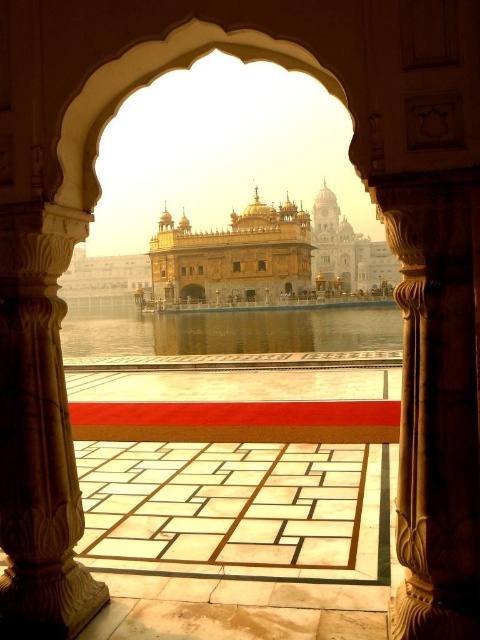
What do you see at coordinates (436, 400) in the screenshot? I see `carved stone pillar at right` at bounding box center [436, 400].

Can you confirm if carved stone pillar at right is thinner than white marble pillar at left?

Indeed, carved stone pillar at right has a lesser width compared to white marble pillar at left.

At what (x,y) coordinates should I click in order to perform the action: click on carved stone pillar at right. Please return your answer as a coordinate pair (x, y). The width and height of the screenshot is (480, 640). Looking at the image, I should click on (436, 400).

You are a GUI agent. You are given a task and a screenshot of the screen. Output one action in this format:
    pyautogui.click(x=<x>, y=<y>)
    Task: Click on the white marble pillar at left
    This screenshot has width=480, height=640.
    Given the screenshot: What is the action you would take?
    pyautogui.click(x=38, y=433)

How distant is white marble pillar at left from golden polished dome at center?

white marble pillar at left is 262.14 feet away from golden polished dome at center.

Who is more distant from viewer, (x=47, y=272) or (x=186, y=296)?

Positioned behind is point (x=186, y=296).

This screenshot has height=640, width=480. Identify the location of white marble pillar at left. (38, 433).

Measure the distance from clear water at center to golden polished dome at center.

clear water at center and golden polished dome at center are 14.51 meters apart from each other.

How distant is clear water at center from golden polished dome at center?

clear water at center is 14.51 meters away from golden polished dome at center.

Find the location of a particular element. The image size is (480, 640). clear water at center is located at coordinates tap(228, 332).